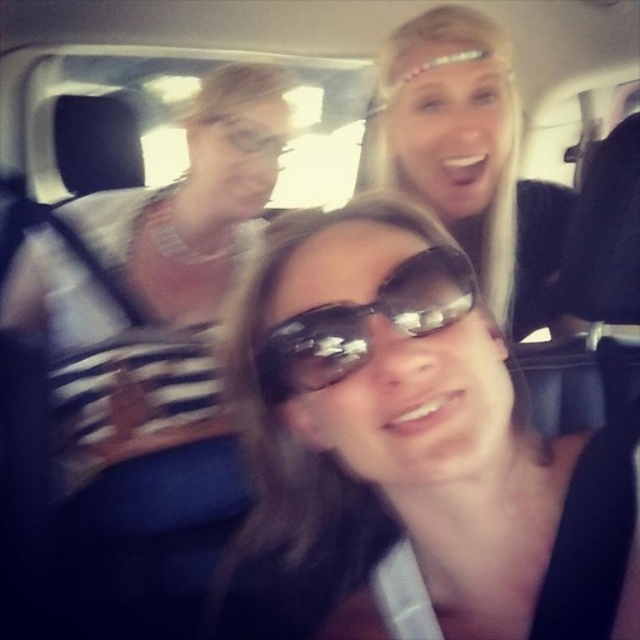
Is sunglasses at center taller than blonde hair at upper center?

No, sunglasses at center is not taller than blonde hair at upper center.

Can you confirm if sunglasses at center is shorter than blonde hair at upper center?

Yes.

Locate an element on the screen. This screenshot has height=640, width=640. sunglasses at center is located at coordinates (406, 448).

Find the location of a particular element. sunglasses at center is located at coordinates (406, 448).

Who is higher up, sunglasses at center or black reflective sunglasses at center?

Answer: black reflective sunglasses at center is above.

Is point (513, 560) positioned behind point (307, 365)?

Yes, point (513, 560) is farther from viewer.

Image resolution: width=640 pixels, height=640 pixels. I want to click on sunglasses at center, so click(406, 448).

Can you confirm if blonde hair at upper center is shorter than black reflective sunglasses at center?

Incorrect, blonde hair at upper center's height does not fall short of black reflective sunglasses at center's.

What do you see at coordinates (472, 157) in the screenshot? The image size is (640, 640). I see `blonde hair at upper center` at bounding box center [472, 157].

At what (x,y) coordinates should I click in order to perform the action: click on blonde hair at upper center. Please return your answer as a coordinate pair (x, y). This screenshot has height=640, width=640. Looking at the image, I should click on (472, 157).